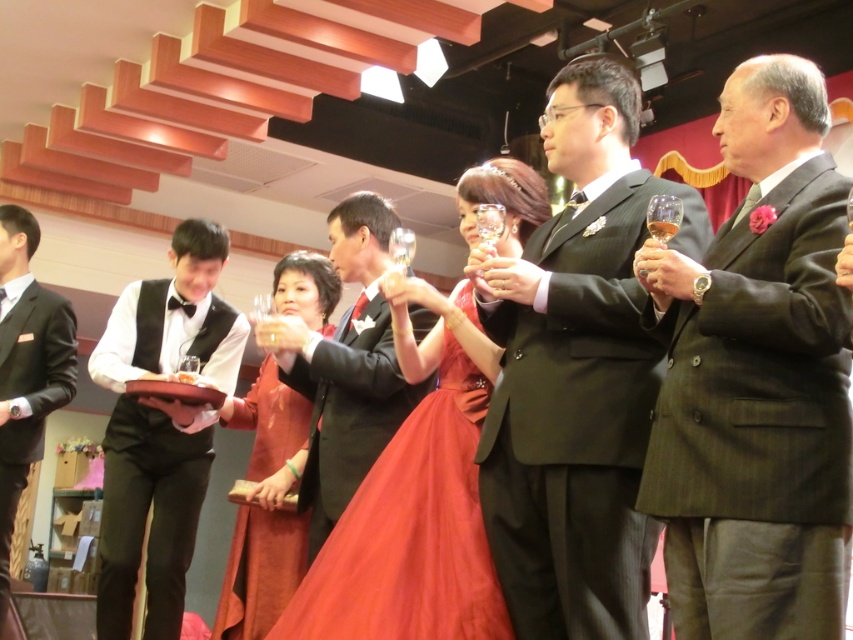
You are a photographer at the event and want to capture a photo of both the black satin vest at center and the matte black suit at left without any obstruction. Based on their positions, which one should you focus on first to ensure both are visible in the frame?

The black satin vest at center is in front of the matte black suit at left, so you should focus on the matte black suit at left first to ensure both are visible without obstruction.

From the picture: You are a photographer at this event and need to position two subjects for a photo. The subjects are wearing the dark green pinstripe suit at center and the velvet red dress at center. To ensure both are visible in the frame, which subject should you place closer to the camera?

The velvet red dress at center should be placed closer to the camera because the dark green pinstripe suit at center is taller, so positioning the shorter velvet red dress at center nearer will help balance their visibility in the photo.